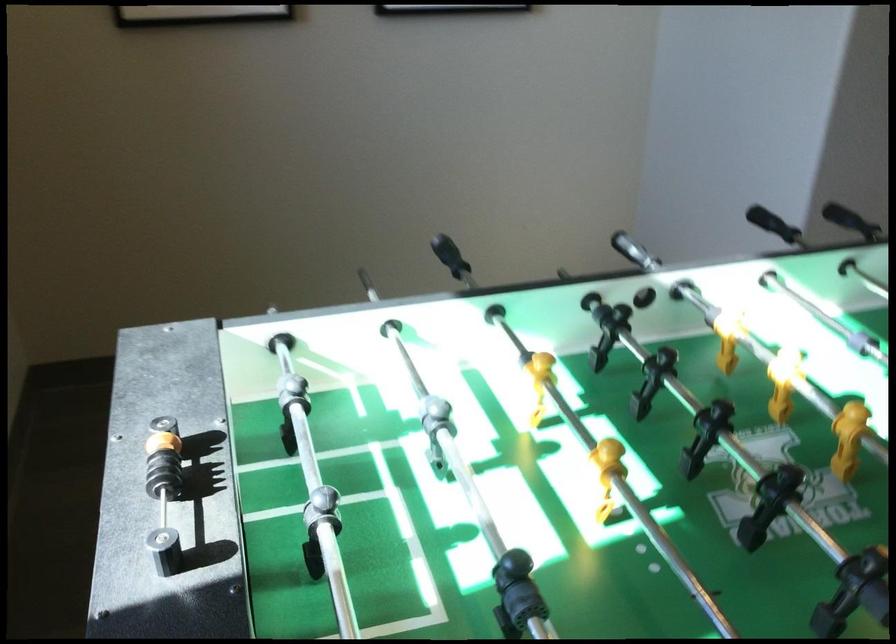
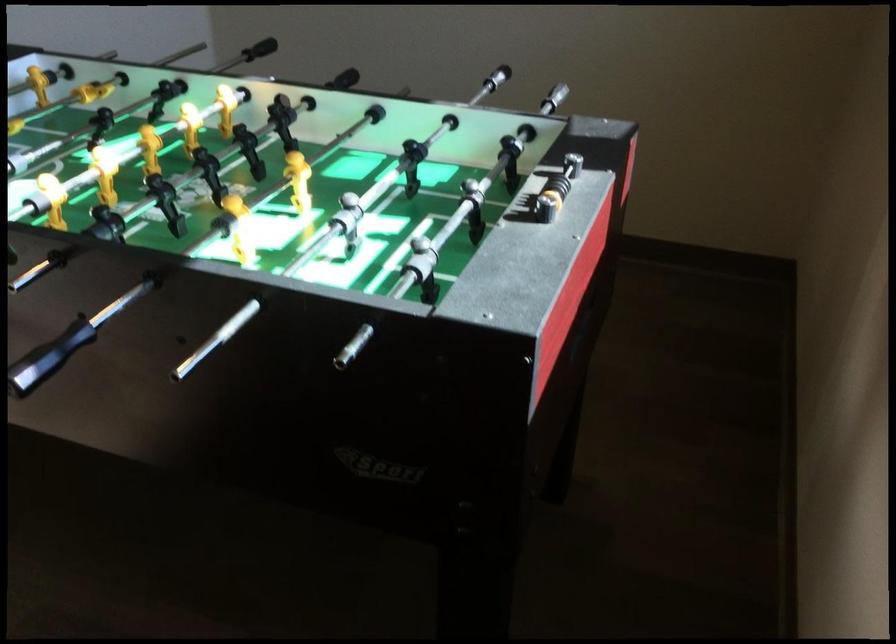
In the second image, find the point that corresponds to pixel 176 469 in the first image.

(556, 185)